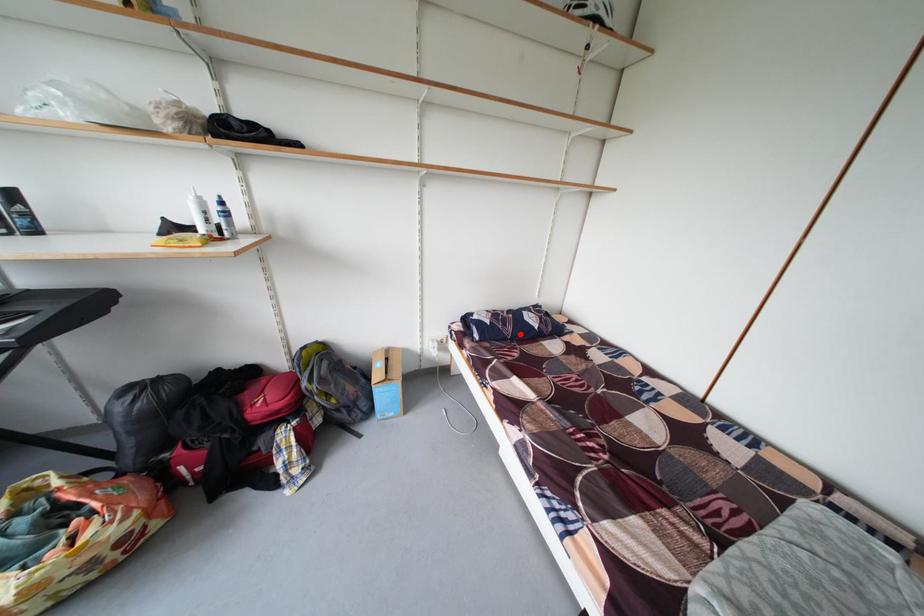
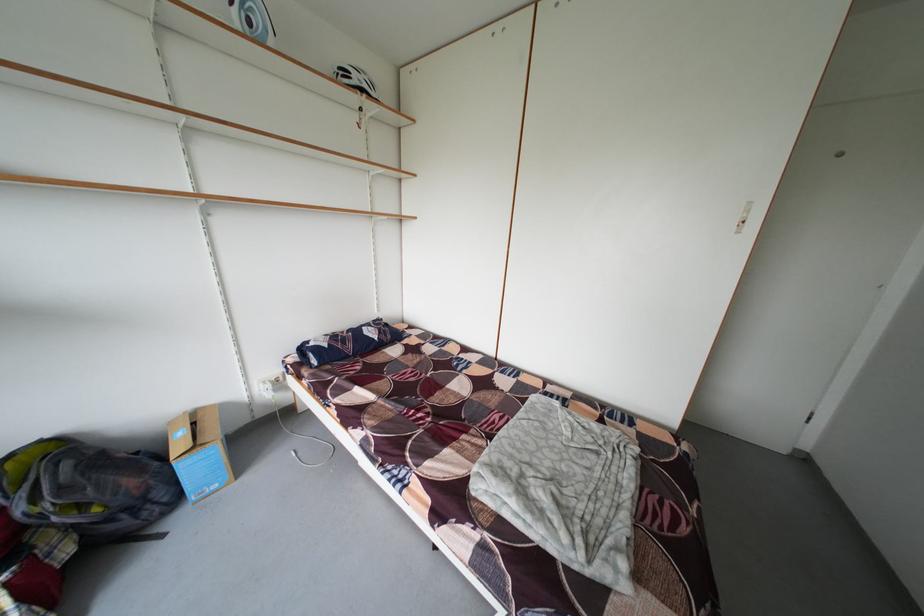
Question: I am providing you with two images of the same scene from different viewpoints. A red point is marked on the first image. At the location where the point appears in image 1, is it still visible in image 2?

Choices:
 (A) Yes
 (B) No

Answer: (A)